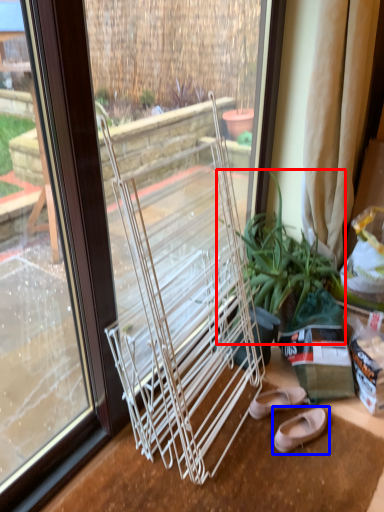
Question: Which point is further to the camera, houseplant (highlighted by a red box) or footwear (highlighted by a blue box)?

Choices:
 (A) houseplant
 (B) footwear

Answer: (B)